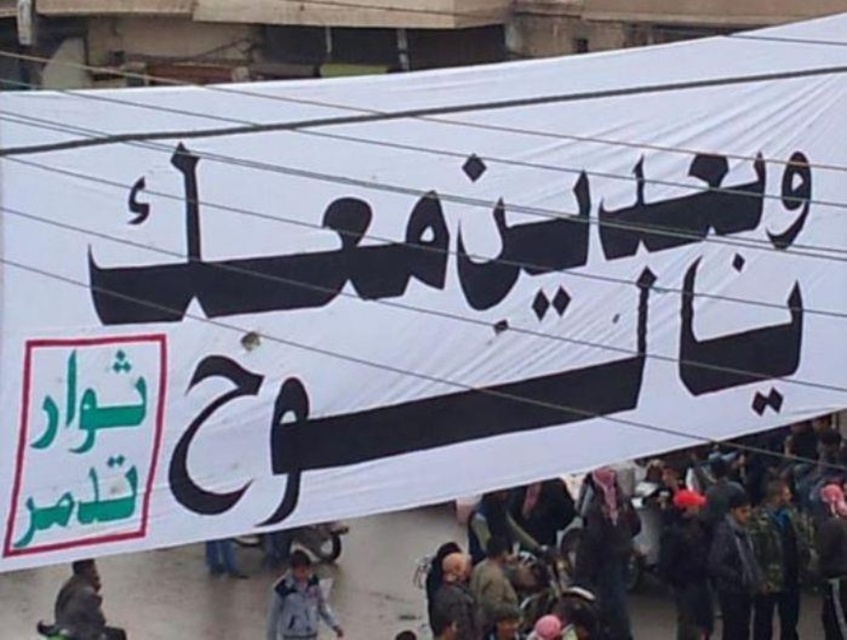
You are a photographer at the protest scene. You need to capture a photo that includes both the dark gray clothing at lower right and the white fleece jacket at center. Which one should you adjust your camera angle to focus on first to ensure both are in frame?

Since the dark gray clothing at lower right is to the right of the white fleece jacket at center, you should first focus on the white fleece jacket at center to ensure both are included in the frame by panning towards the left from the dark gray clothing at lower right.

You are a photographer trying to capture the protesters holding the banner. You notice the dark gray clothing at lower right and the brown leather jacket at lower left. Which clothing item is covering part of the other?

The dark gray clothing at lower right is positioned over the brown leather jacket at lower left, so it is covering part of it.